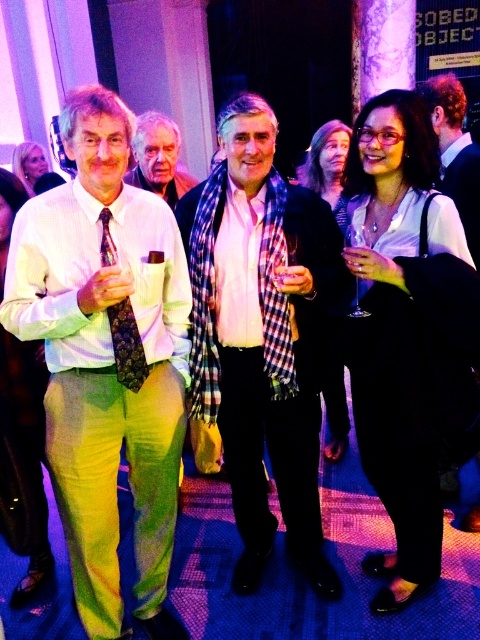
Can you confirm if dark brown hair at upper right is bigger than dark purple floral tie at left?

Indeed, dark brown hair at upper right has a larger size compared to dark purple floral tie at left.

Which of these two, dark brown hair at upper right or dark purple floral tie at left, stands taller?

dark brown hair at upper right

Who is more forward, (448, 88) or (140, 378)?

Point (140, 378) is in front.

Find the location of a particular element. The image size is (480, 640). dark brown hair at upper right is located at coordinates click(x=456, y=152).

Can you confirm if matte black scarf at center is wider than dark purple floral tie at left?

Indeed, matte black scarf at center has a greater width compared to dark purple floral tie at left.

Which is behind, point (162, 164) or point (121, 348)?

The point (162, 164) is behind.

I want to click on matte black scarf at center, so click(157, 157).

Does white striped shirt at left have a lesser height compared to dark purple floral tie at left?

In fact, white striped shirt at left may be taller than dark purple floral tie at left.

Does white striped shirt at left come behind dark purple floral tie at left?

No, it is in front of dark purple floral tie at left.

At what (x,y) coordinates should I click in order to perform the action: click on white striped shirt at left. Please return your answer as a coordinate pair (x, y). The height and width of the screenshot is (640, 480). Looking at the image, I should click on (107, 358).